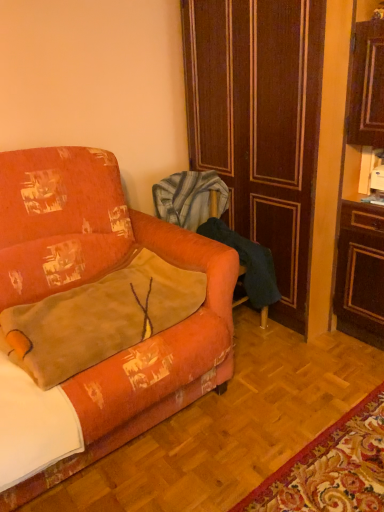
You are a GUI agent. You are given a task and a screenshot of the screen. Output one action in this format:
    pyautogui.click(x=<x>, y=<y>)
    Task: Click on the free spot in front of velvet orange armchair at center
    The image size is (384, 512).
    Given the screenshot: What is the action you would take?
    pyautogui.click(x=262, y=386)